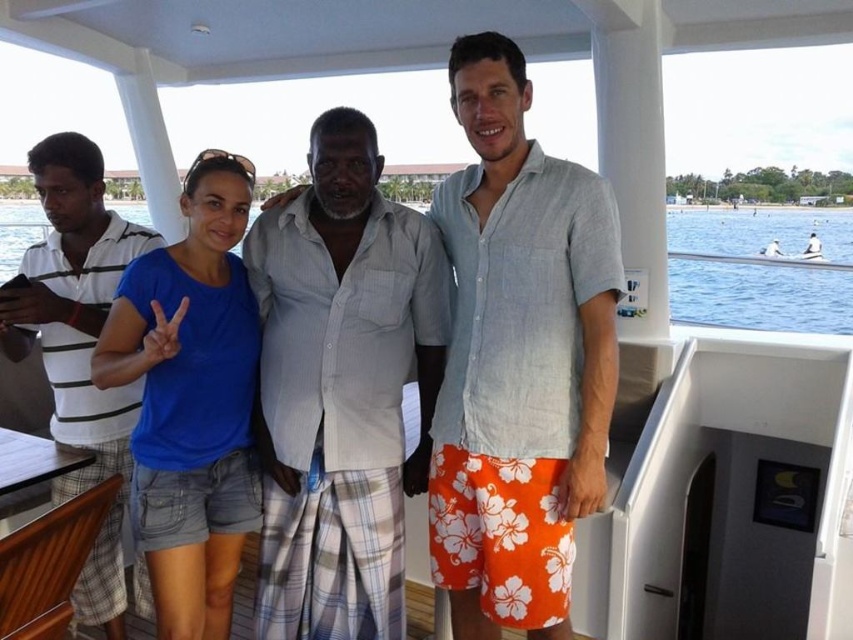
From the picture: Is light gray striped shirt at center thinner than orange floral shorts at center?

No, light gray striped shirt at center is not thinner than orange floral shorts at center.

Is the position of light gray striped shirt at center more distant than that of orange floral shorts at center?

No, light gray striped shirt at center is in front of orange floral shorts at center.

Does point (366, 356) lie in front of point (808, 241)?

Yes, it is.

Locate an element on the screen. light gray striped shirt at center is located at coordinates (341, 387).

Between point (94, 212) and point (4, 273), which one is positioned behind?

The point (4, 273) is more distant.

Is point (15, 298) less distant than point (744, 280)?

That is True.

Is point (107, 621) farther from viewer compared to point (775, 284)?

No.

Where is `white striped polo shirt at left`? white striped polo shirt at left is located at coordinates (74, 305).

Is light blue linen shirt at center shorter than light gray striped shirt at center?

Incorrect, light blue linen shirt at center's height does not fall short of light gray striped shirt at center's.

Between point (440, 564) and point (405, 348), which one is positioned in front?

Positioned in front is point (405, 348).

Between point (505, 134) and point (292, 212), which one is positioned behind?

Point (292, 212)

At what (x,y) coordinates should I click in order to perform the action: click on light blue linen shirt at center. Please return your answer as a coordinate pair (x, y). Looking at the image, I should click on (518, 356).